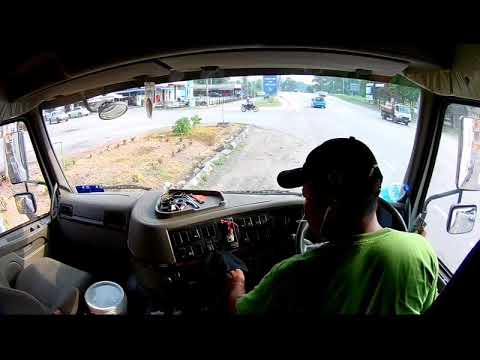
Find the location of `cup`. cup is located at coordinates (110, 300).